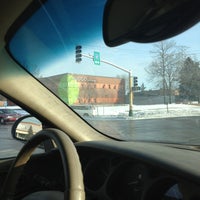
This screenshot has height=200, width=200. Identify the location of mirror\. (28, 128).